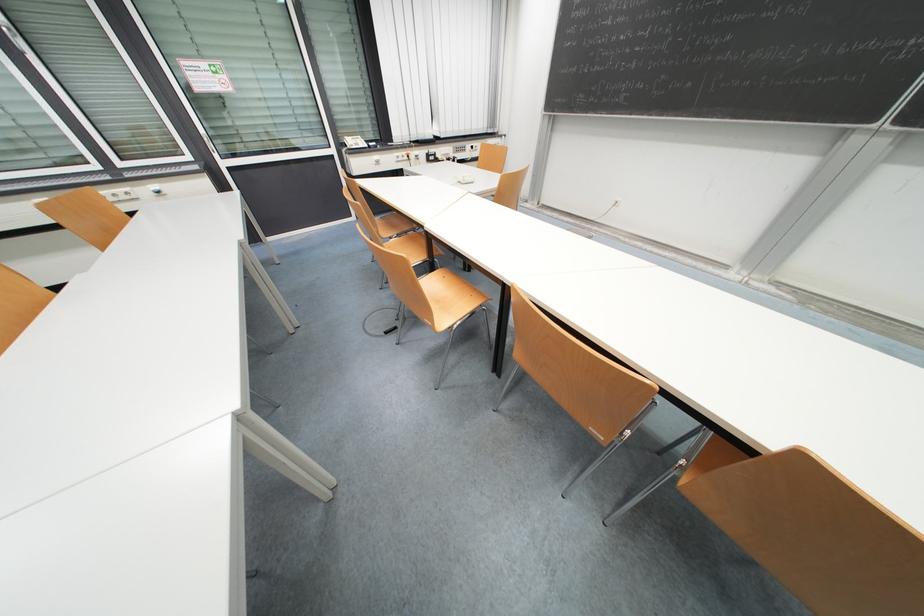
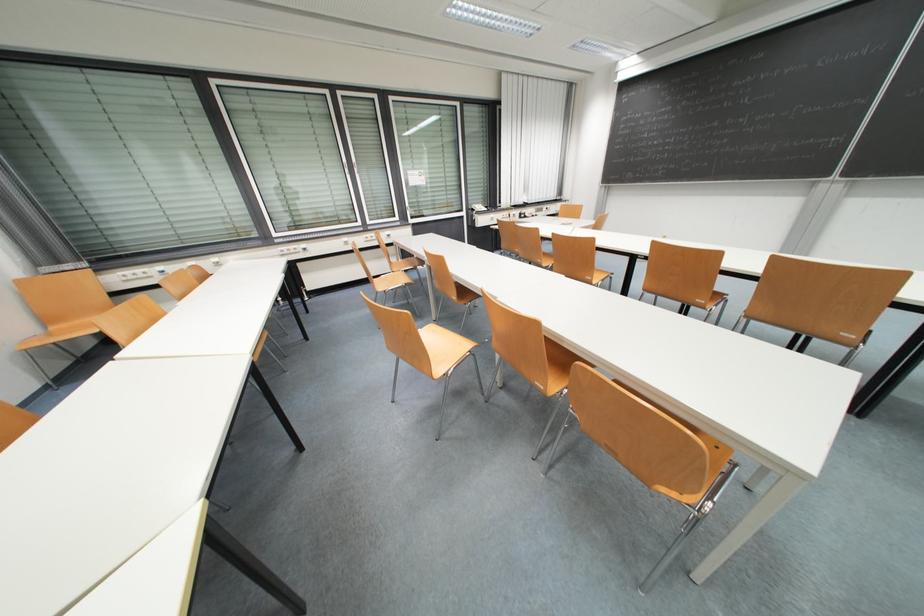
Which direction would the cameraman need to move to produce the second image?

The cameraman walked toward left, backward.